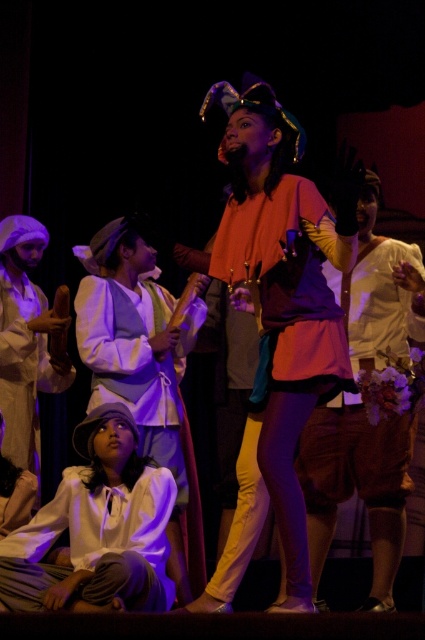
Question: Which point is closer to the camera?

Choices:
 (A) (36, 541)
 (B) (169, 468)
 (C) (71, 380)

Answer: (A)

Question: Does matte orange shirt at center appear on the left side of white cotton shirt at lower left?

Choices:
 (A) yes
 (B) no

Answer: (B)

Question: Considering the real-world distances, which object is closest to the white cotton shirt at lower left?

Choices:
 (A) matte orange shirt at center
 (B) matte white blouse at center
 (C) white cotton hat at lower left
 (D) matte orange blouse at center

Answer: (B)

Question: Which of the following is the closest to the observer?

Choices:
 (A) matte orange blouse at center
 (B) matte orange shirt at center
 (C) matte white blouse at center
 (D) white cotton hat at lower left

Answer: (A)

Question: Is matte orange blouse at center bigger than white cotton shirt at lower left?

Choices:
 (A) yes
 (B) no

Answer: (A)

Question: Does matte orange shirt at center have a smaller size compared to white cotton shirt at lower left?

Choices:
 (A) no
 (B) yes

Answer: (A)